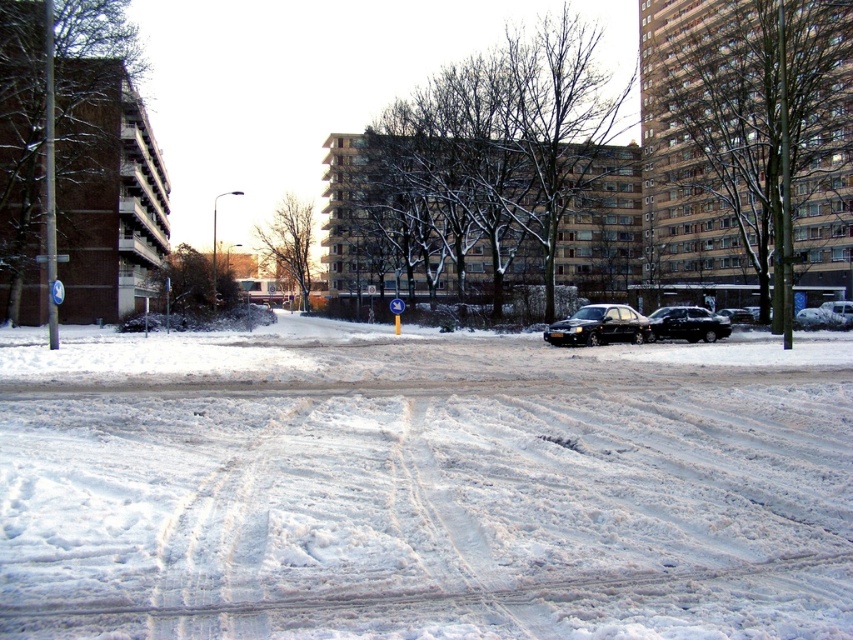
You are standing at the camera position and want to reach the point marked at coordinates (579, 316) in the image. Considering the snow conditions described, do you think you can walk directly to that point without encountering any obstacles?

The point at coordinates (579, 316) is 113.46 feet away from the camera. Since the snow is unevenly packed with some compacted areas and tire tracks, there may be obstacles like loose snow or uneven terrain. However, the description does not mention specific obstacles blocking the path, so it might be possible to walk directly there, though caution is advised due to potential slippery or uneven snow conditions.

You are a delivery driver who needs to park your vehicle on the snow at center. You see the white powdery snow at center and the black glossy sedan at center. Which area should you choose to park your vehicle to avoid blocking the sedan?

You should park on the white powdery snow at center because it is positioned on the left side of the black glossy sedan at center, so parking there would keep the sedan unblocked.